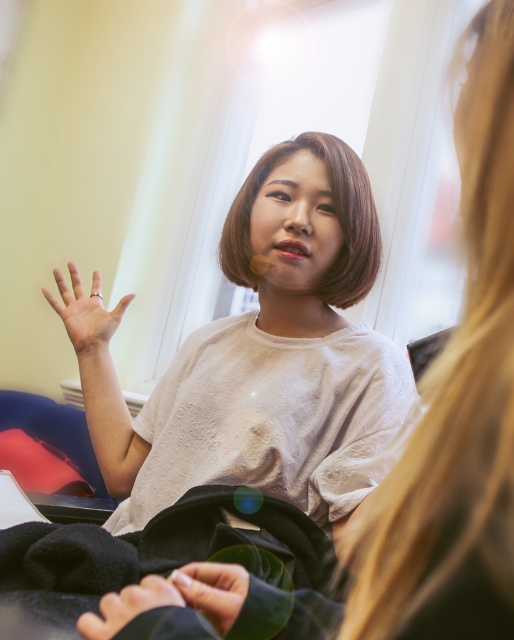
You are standing in the room and want to move from point A at point [98,358] to point B at point [107,593]. Since you can only move forward, which direction should you turn to reach point B from point A?

Since point A at point [98,358] is closer to you than point B at point [107,593], you should turn around and move backward to reach point B from point A.

You are a jeweler observing the scene. You need to place a protective case between the silver metallic ring at center and the smooth black hand at center. Based on their positions, where should you position the case?

The silver metallic ring at center is to the left of the smooth black hand at center, so you should place the protective case to the right of the silver metallic ring at center and to the left of the smooth black hand at center between them.

You are a photographer setting up a shoot in this scene. You need to position a light source so that it illuminates the white matte shirt at center without casting a shadow from the smooth black hand at center. Is this possible given their positions?

The white matte shirt at center is above the smooth black hand at center, so positioning the light source directly above the shirt would illuminate it while keeping the hand below, thus avoiding casting a shadow from the hand onto the shirt.